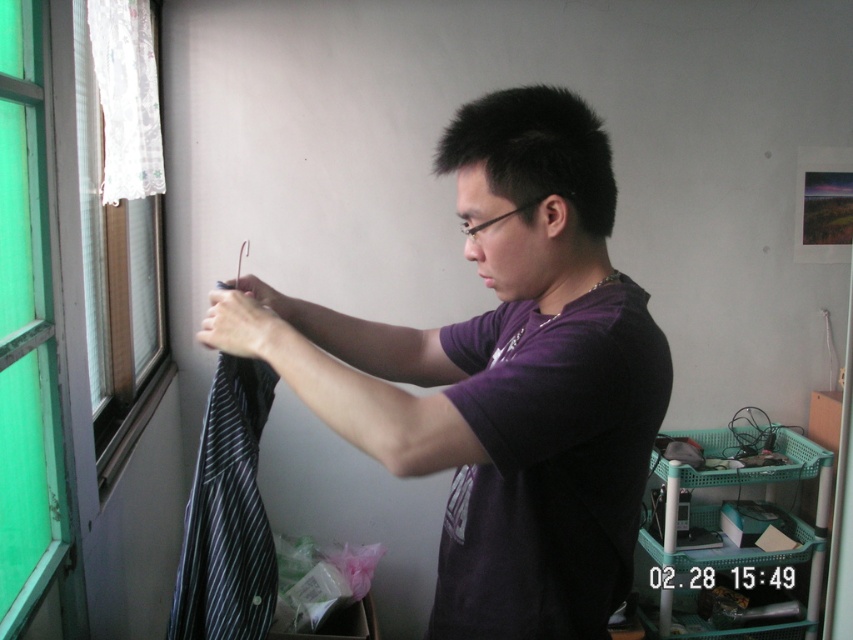
Between green glass window at left and white lace curtain at left, which one is positioned higher?

Positioned higher is white lace curtain at left.

Is green glass window at left closer to camera compared to white lace curtain at left?

Yes, green glass window at left is closer to the viewer.

Who is more distant from viewer, [3,333] or [85,51]?

Point [85,51]

The image size is (853, 640). In order to click on green glass window at left in this screenshot , I will do `click(30, 340)`.

Can you confirm if green glass window at left is positioned below white lace curtain at upper left?

Indeed, green glass window at left is positioned under white lace curtain at upper left.

Is green glass window at left smaller than white lace curtain at upper left?

Indeed, green glass window at left has a smaller size compared to white lace curtain at upper left.

Who is more forward, (x=36, y=362) or (x=102, y=13)?

Point (x=36, y=362)

The width and height of the screenshot is (853, 640). Identify the location of green glass window at left. (30, 340).

Between purple matte shirt at center and black striped shirt at left, which one appears on the left side from the viewer's perspective?

black striped shirt at left

This screenshot has height=640, width=853. Identify the location of purple matte shirt at center. (502, 378).